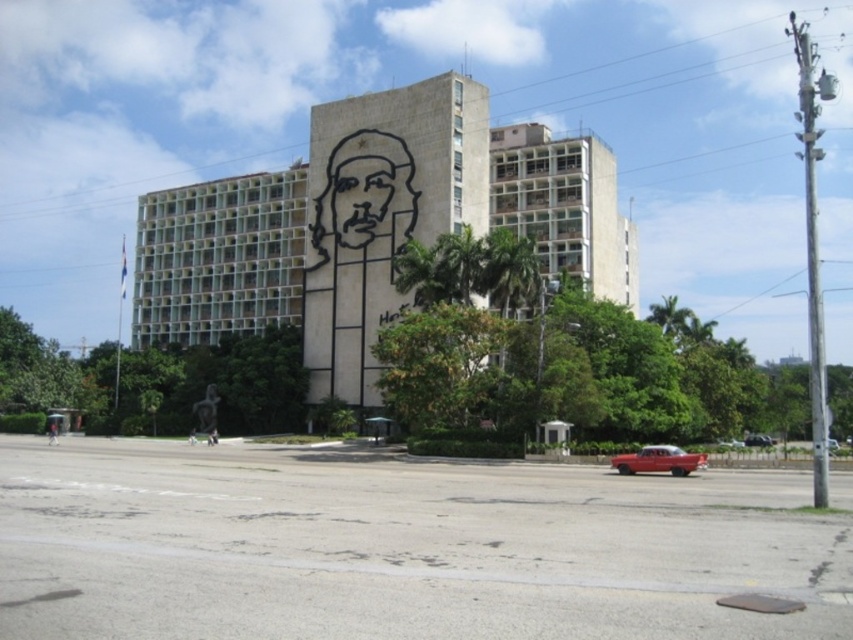
Question: Is shiny red car at lower center positioned at the back of metallic red car at center?

Choices:
 (A) yes
 (B) no

Answer: (A)

Question: Does beige stone building at center appear on the right side of metallic red car at center?

Choices:
 (A) yes
 (B) no

Answer: (B)

Question: Considering the real-world distances, which object is closest to the shiny red car at lower right?

Choices:
 (A) shiny red car at center
 (B) black line drawing face at center
 (C) beige stone building at center
 (D) metallic red car at center

Answer: (A)

Question: Is beige stone building at center wider than shiny red car at lower right?

Choices:
 (A) no
 (B) yes

Answer: (B)

Question: Which is nearer to the metallic red car at center?

Choices:
 (A) shiny red car at center
 (B) black line drawing face at center
 (C) shiny red car at lower right

Answer: (C)

Question: Which of these objects is positioned closest to the metallic red car at center?

Choices:
 (A) shiny red car at center
 (B) beige stone building at center

Answer: (A)